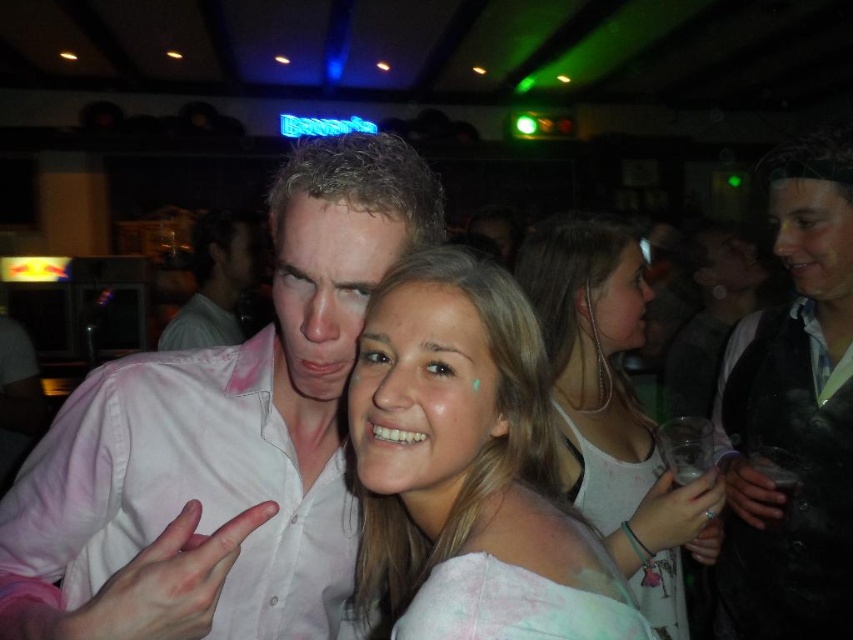
Question: Is pink cotton shirt at center positioned before white tank top at center?

Choices:
 (A) yes
 (B) no

Answer: (A)

Question: Which point appears farthest from the camera in this image?

Choices:
 (A) (312, 212)
 (B) (646, 561)
 (C) (434, 284)
 (D) (206, 266)

Answer: (D)

Question: Does pink cotton shirt at center come behind matte white shirt at center?

Choices:
 (A) yes
 (B) no

Answer: (B)

Question: Can you confirm if white tank top at center is positioned below matte white shirt at center?

Choices:
 (A) no
 (B) yes

Answer: (B)

Question: Which object appears farthest from the camera in this image?

Choices:
 (A) pink cotton shirt at center
 (B) matte white shirt at center
 (C) light brown hair at center

Answer: (B)

Question: Which point appears farthest from the camera in this image?

Choices:
 (A) (457, 276)
 (B) (193, 234)
 (C) (393, 241)
 (D) (616, 429)

Answer: (B)